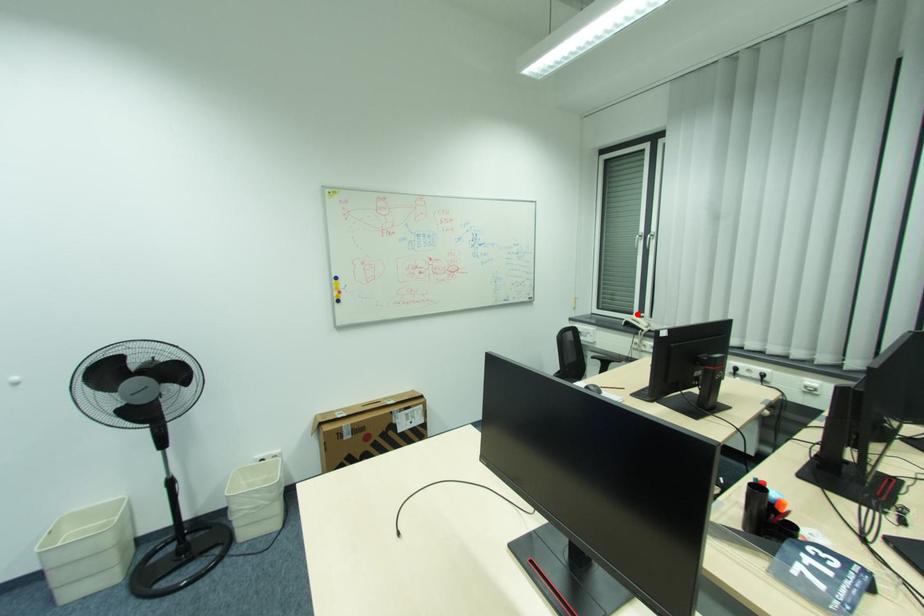
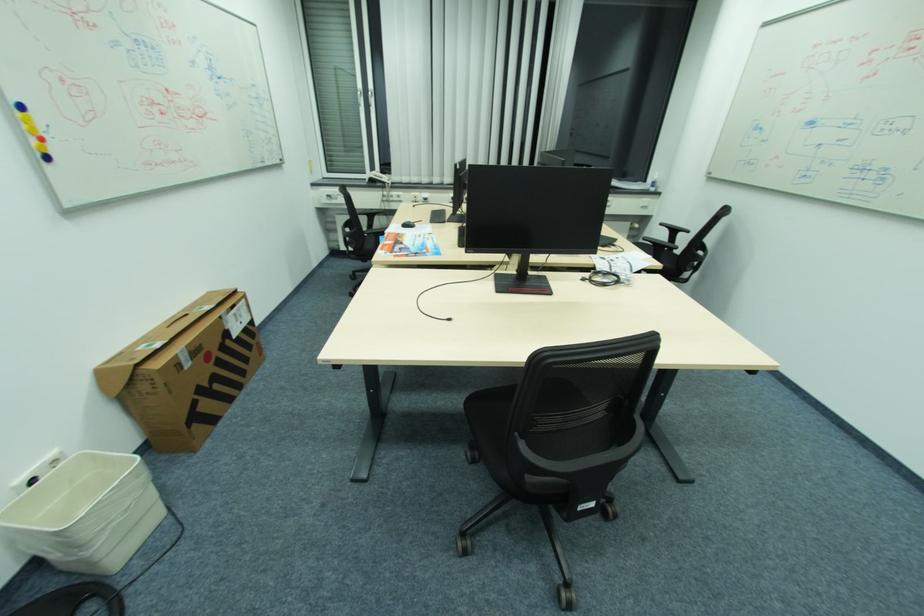
Question: A red point is marked in image1. In image2, is the corresponding 3D point closer to the camera or farther? Reply with the corresponding letter.

Choices:
 (A) The corresponding 3D point is closer.
 (B) The corresponding 3D point is farther.

Answer: (A)